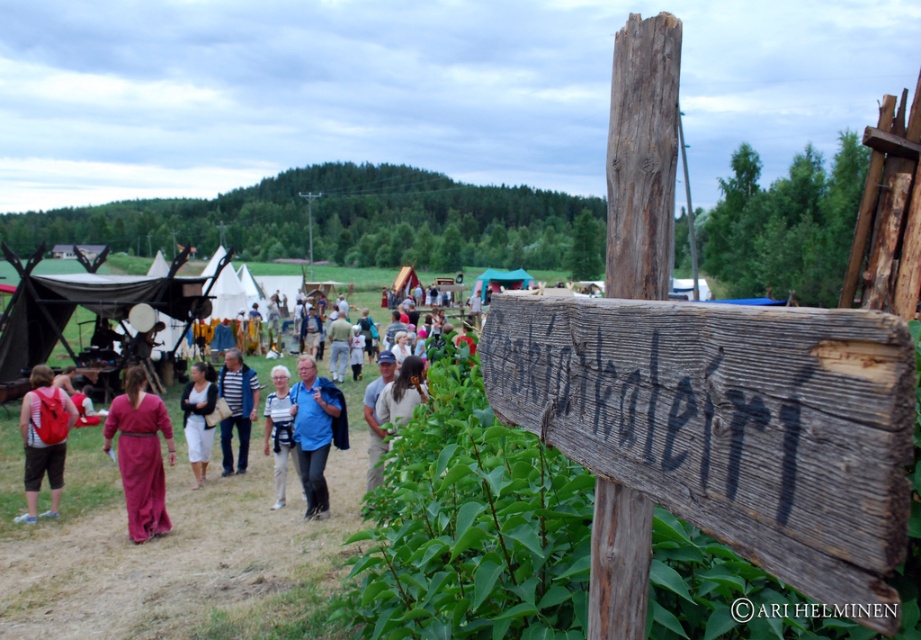
Who is lower down, white cotton dress at center or blue fabric shirt at center?

white cotton dress at center

Is point (197, 483) farther from camera compared to point (344, 317)?

No, (197, 483) is closer to viewer.

Image resolution: width=921 pixels, height=640 pixels. In order to click on white cotton dress at center in this screenshot , I will do `click(197, 417)`.

Is matte pink dress at center above blue fabric shirt at center?

Actually, matte pink dress at center is below blue fabric shirt at center.

Is the position of matte pink dress at center more distant than that of blue fabric shirt at center?

No, it is in front of blue fabric shirt at center.

Where is `matte pink dress at center`? The image size is (921, 640). matte pink dress at center is located at coordinates (140, 454).

This screenshot has width=921, height=640. In order to click on matte pink dress at center in this screenshot , I will do `click(140, 454)`.

At what (x,y) coordinates should I click in order to perform the action: click on blue striped shirt at center. Please return your answer as a coordinate pair (x, y). This screenshot has width=921, height=640. Looking at the image, I should click on (236, 406).

Consider the image. Can you confirm if blue striped shirt at center is positioned to the right of white cotton dress at center?

Indeed, blue striped shirt at center is positioned on the right side of white cotton dress at center.

Who is more distant from viewer, (222, 374) or (197, 392)?

Positioned behind is point (222, 374).

The width and height of the screenshot is (921, 640). In order to click on blue striped shirt at center in this screenshot , I will do `click(236, 406)`.